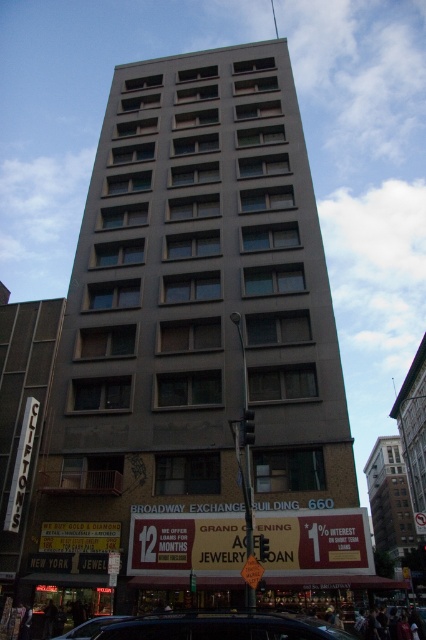
Question: Observing the image, what is the correct spatial positioning of shiny black car at lower center in reference to shiny black car at lower left?

Choices:
 (A) below
 (B) above

Answer: (B)

Question: Which point is farther to the camera?

Choices:
 (A) shiny black car at lower center
 (B) gray concrete building at center

Answer: (B)

Question: Can you confirm if shiny black car at lower center is thinner than shiny black car at lower left?

Choices:
 (A) yes
 (B) no

Answer: (B)

Question: Does shiny black car at lower center appear on the left side of shiny black car at lower left?

Choices:
 (A) yes
 (B) no

Answer: (B)

Question: Among these points, which one is farthest from the camera?

Choices:
 (A) (101, 620)
 (B) (222, 483)

Answer: (B)

Question: Which of the following is the farthest from the observer?

Choices:
 (A) (199, 272)
 (B) (71, 636)

Answer: (A)